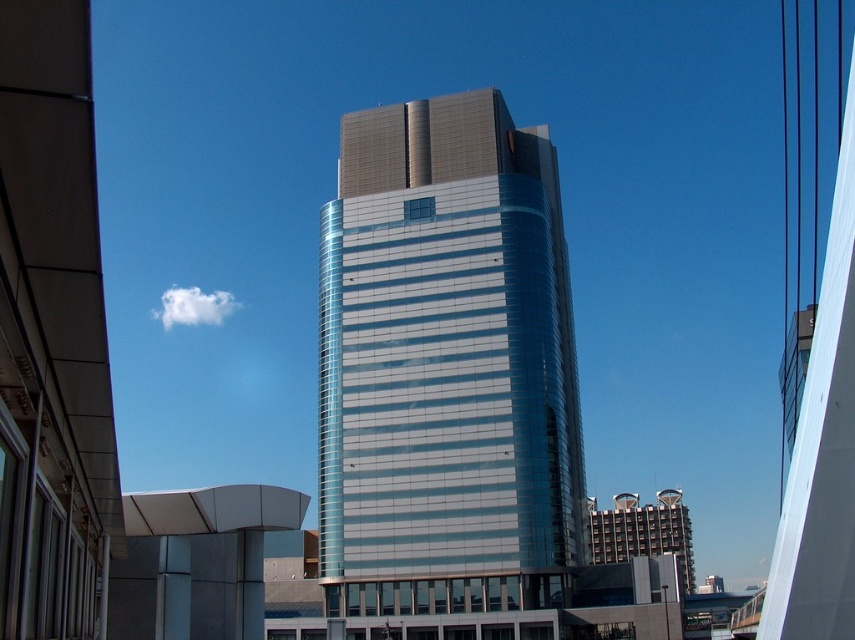
Measure the distance between shiny glass tower at center and camera.

shiny glass tower at center and camera are 78.98 meters apart.

What do you see at coordinates (446, 349) in the screenshot? The image size is (855, 640). I see `shiny glass tower at center` at bounding box center [446, 349].

This screenshot has height=640, width=855. I want to click on shiny glass tower at center, so click(446, 349).